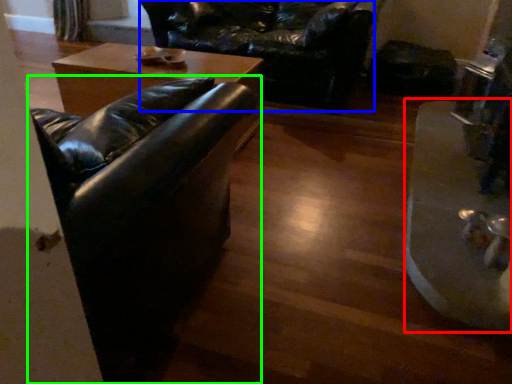
Question: Considering the real-world distances, which object is farthest from wide (highlighted by a red box)? swivel chair (highlighted by a blue box) or studio couch (highlighted by a green box)?

Choices:
 (A) swivel chair
 (B) studio couch

Answer: (A)